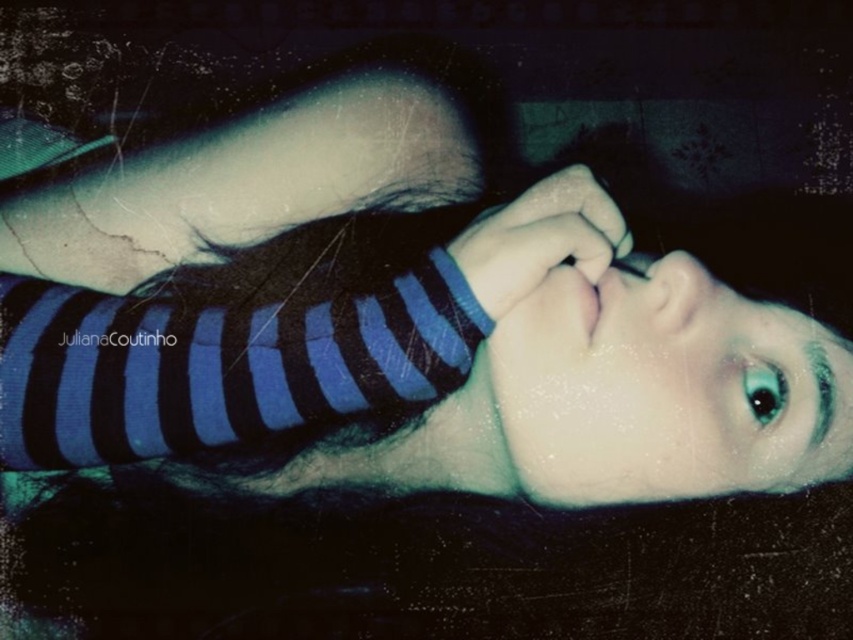
Question: Which object is closer to the camera taking this photo?

Choices:
 (A) blue striped shirt at center
 (B) blue striped fabric at center
 (C) teal glossy eye at upper right

Answer: (B)

Question: Can you confirm if blue striped shirt at center is bigger than blue striped fabric at center?

Choices:
 (A) no
 (B) yes

Answer: (B)

Question: Is blue striped shirt at center smaller than blue striped fabric at center?

Choices:
 (A) no
 (B) yes

Answer: (A)

Question: Can you confirm if smooth skin face at center is bigger than blue striped fabric at center?

Choices:
 (A) no
 (B) yes

Answer: (B)

Question: Among these objects, which one is nearest to the camera?

Choices:
 (A) smooth skin hand at center
 (B) smooth skin face at center
 (C) blue striped shirt at center
 (D) teal glossy eye at upper right

Answer: (A)

Question: Which point is closer to the camera?

Choices:
 (A) (561, 259)
 (B) (547, 387)

Answer: (A)